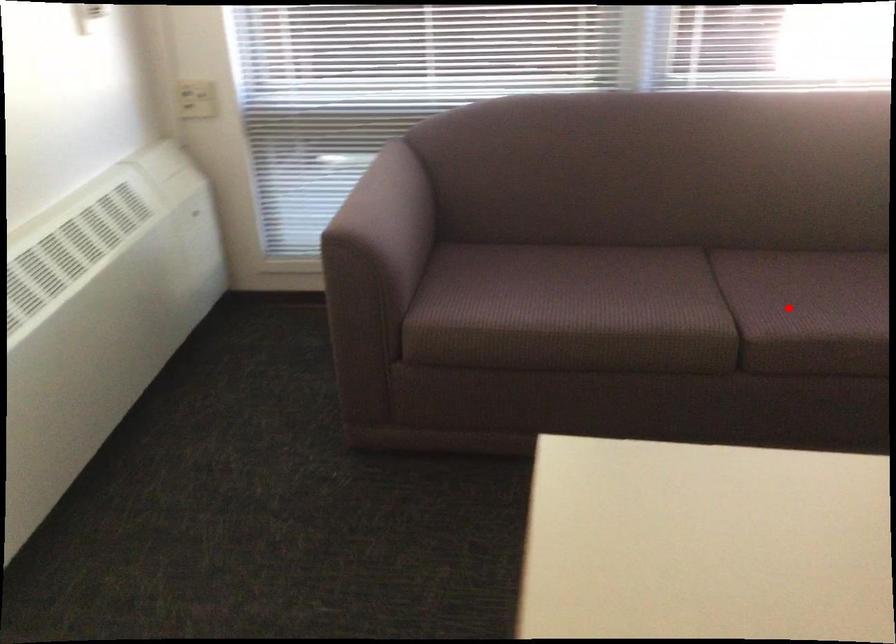
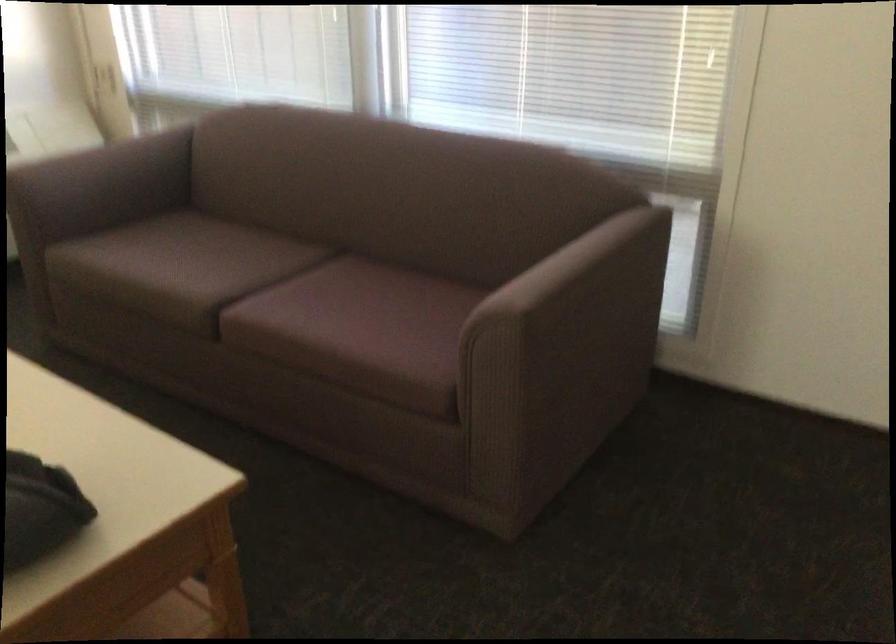
Locate, in the second image, the point that corresponds to the highlighted location in the first image.

(277, 299)